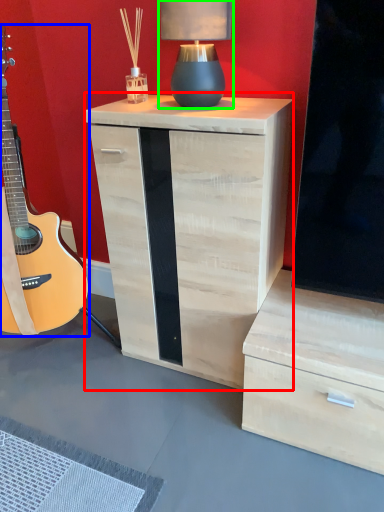
Question: Which is farther away from nightstand (highlighted by a red box)? guitar (highlighted by a blue box) or table lamp (highlighted by a green box)?

Choices:
 (A) guitar
 (B) table lamp

Answer: (A)